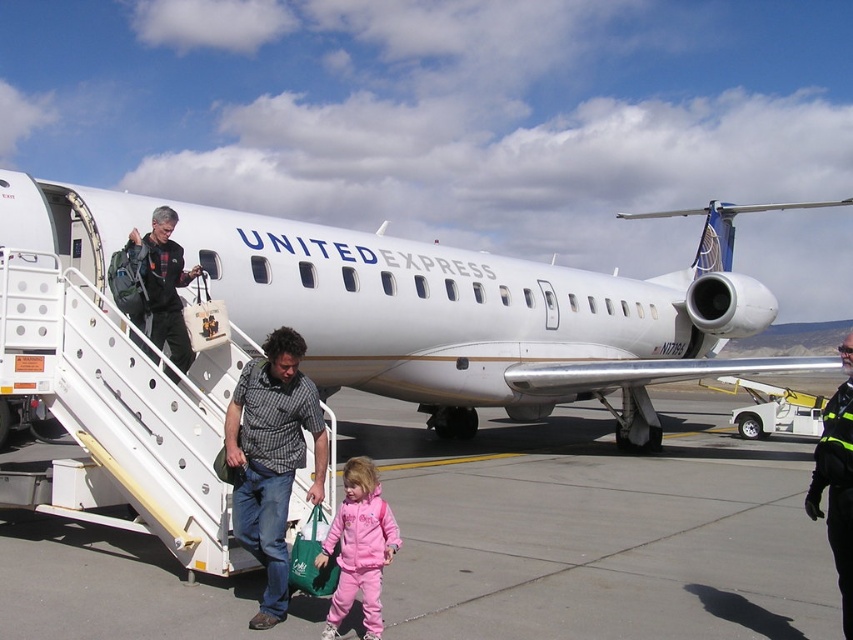
You are a passenger at the airport and need to find the plaid flannel shirt at upper left. Based on the scene, where would you look in relation to the gray concrete tarmac at center?

The gray concrete tarmac at center is positioned under the plaid flannel shirt at upper left, so you should look above the gray concrete tarmac at center to find the plaid flannel shirt at upper left.

What is the relationship in width between the gray concrete tarmac at center and the plaid flannel shirt at upper left?

The gray concrete tarmac at center is wider than the plaid flannel shirt at upper left.

What is the location of the gray concrete tarmac at center in the image?

The gray concrete tarmac at center is located at point (596, 529) in the image.